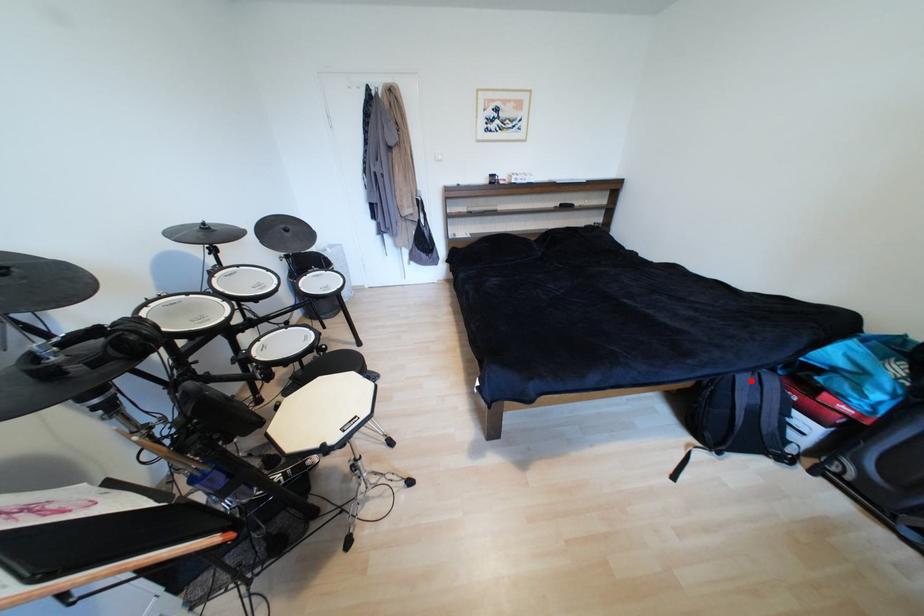
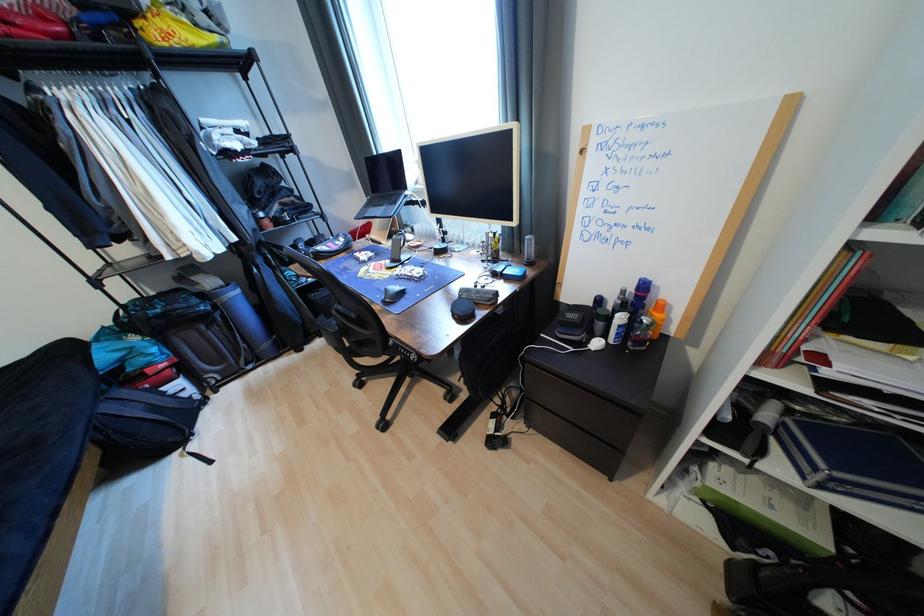
Question: I am providing you with two images of the same scene from different viewpoints. A red point is marked on the first image. At the location where the point appears in image 1, is it still visible in image 2?

Choices:
 (A) Yes
 (B) No

Answer: (A)